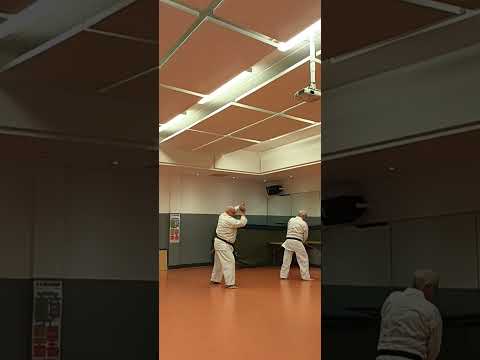
The image size is (480, 360). In order to click on ceiling in this screenshot , I will do `click(215, 74)`.